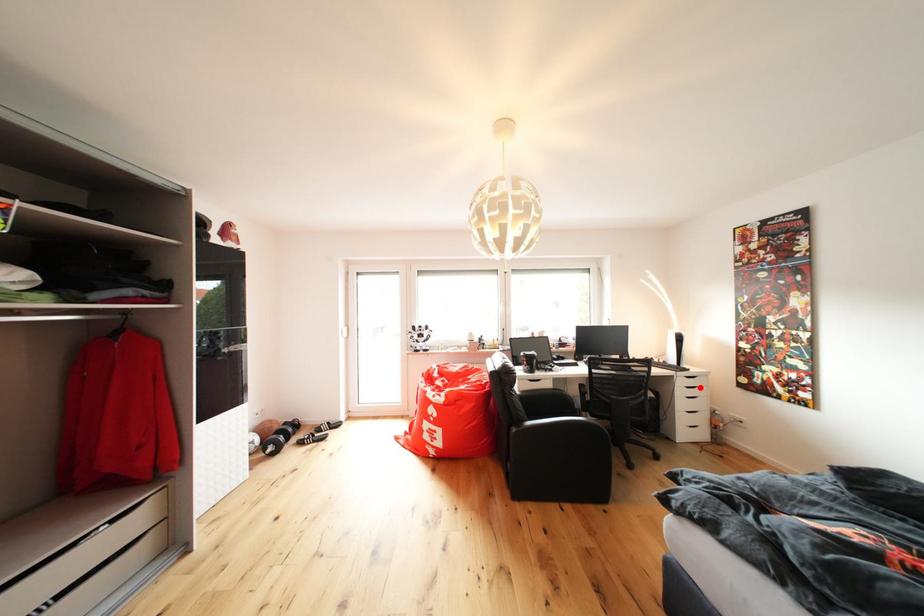
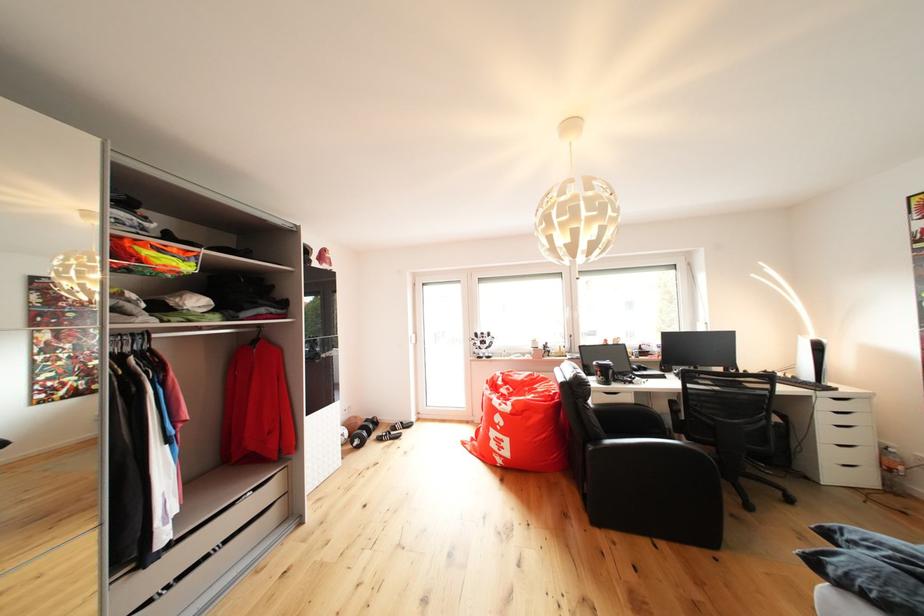
In the second image, find the point that corresponds to the highlighted location in the first image.

(850, 411)